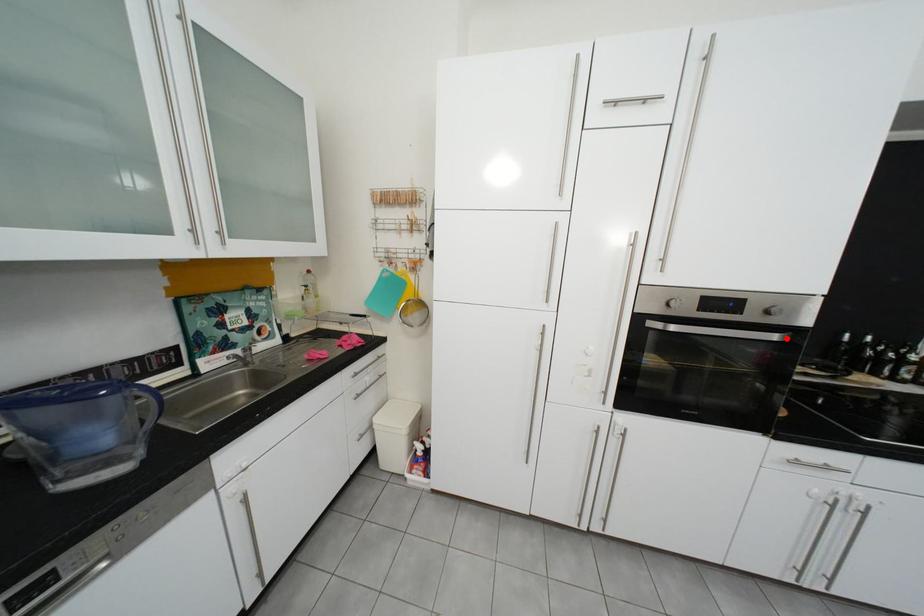
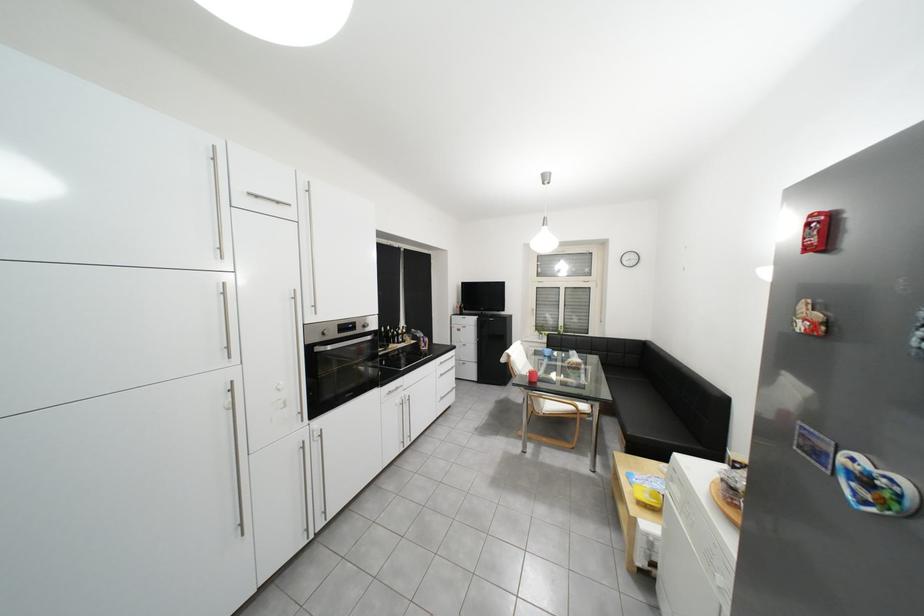
Where in the second image is the point corresponding to the highlighted location from the first image?

(381, 339)